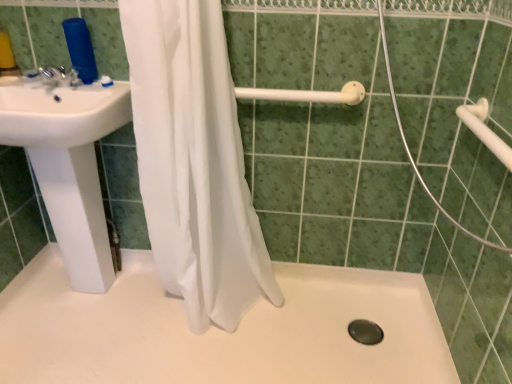
I want to click on free space to the right of black rubber drain at bottom center, so click(x=397, y=332).